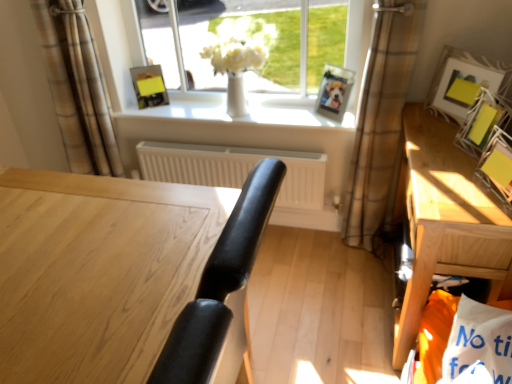
Where is `free space to the left of brown plaid curtain at center right, which is the first curtain from right to left`? free space to the left of brown plaid curtain at center right, which is the first curtain from right to left is located at coordinates (310, 257).